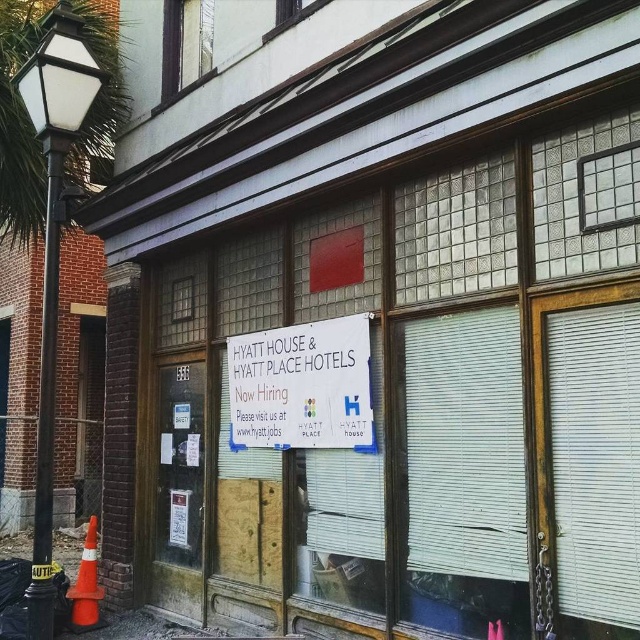
You are a job seeker passing by the Hyatt House and Hyatt Place building. You notice two clear glass windows on the upper part of the building. Which window, the clear glass window at upper left or the clear glass window at upper center, is wider?

The clear glass window at upper left is wider than the clear glass window at upper center.

You are a job seeker looking at the Hyatt House and Hyatt Place Hotels building. You notice the white paper sign at center and the clear glass window at upper left. Which object is taller?

The white paper sign at center is taller than the clear glass window at upper left.